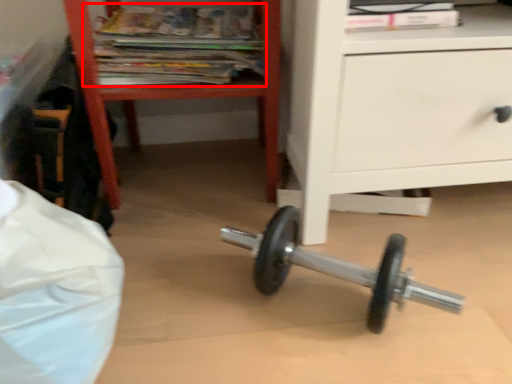
Question: In this image, where is magazine (annotated by the red box) located relative to furniture?

Choices:
 (A) right
 (B) left

Answer: (B)